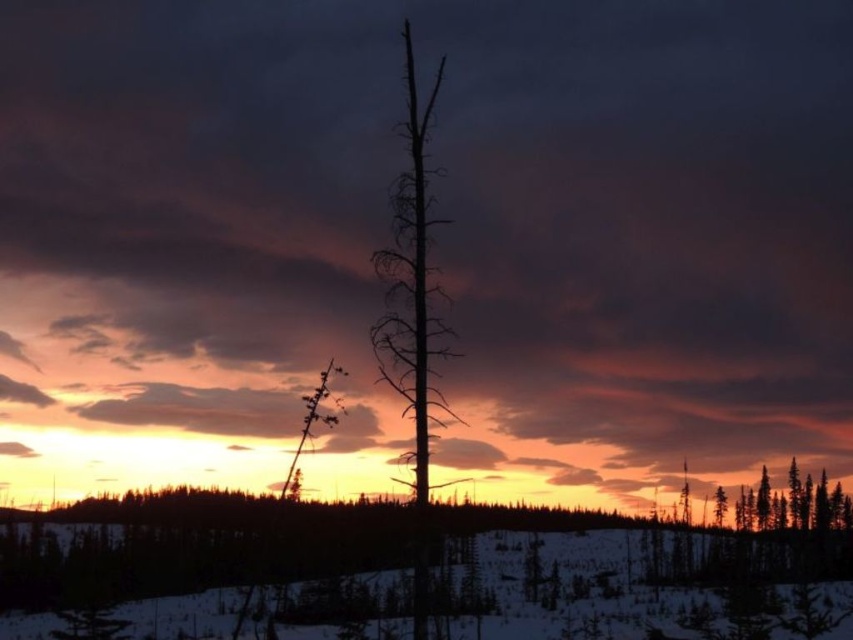
Question: Which is farther from the silhouette deadwood at center?

Choices:
 (A) smooth brown tree trunk at right
 (B) white matte snow at center

Answer: (A)

Question: Can you confirm if silhouette deadwood at center is wider than smooth brown tree trunk at right?

Choices:
 (A) yes
 (B) no

Answer: (A)

Question: Is white matte snow at center to the left of smooth brown tree trunk at right from the viewer's perspective?

Choices:
 (A) no
 (B) yes

Answer: (B)

Question: Estimate the real-world distances between objects in this image. Which object is closer to the smooth brown tree trunk at right?

Choices:
 (A) white matte snow at center
 (B) silhouette deadwood at center

Answer: (A)

Question: Is silhouette deadwood at center above smooth brown tree trunk at right?

Choices:
 (A) yes
 (B) no

Answer: (A)

Question: Estimate the real-world distances between objects in this image. Which object is farther from the smooth brown tree trunk at right?

Choices:
 (A) silhouette deadwood at center
 (B) white matte snow at center

Answer: (A)